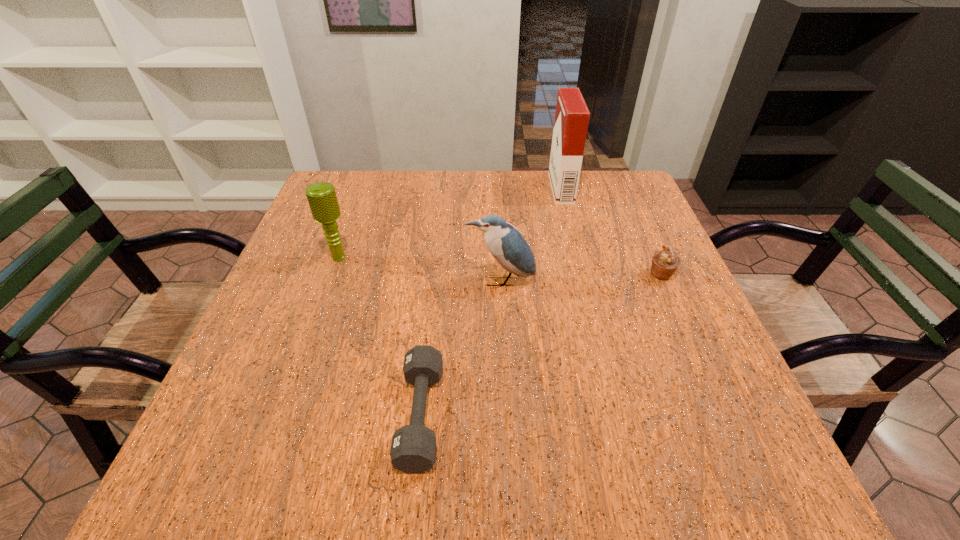
Identify the location of the farthest object. Image resolution: width=960 pixels, height=540 pixels. (572, 116).

This screenshot has width=960, height=540. Find the location of `the second object from right to left`. the second object from right to left is located at coordinates (572, 116).

Image resolution: width=960 pixels, height=540 pixels. Identify the location of microphone. click(x=322, y=199).

Find the location of a particular element. This screenshot has height=540, width=960. the leftmost object is located at coordinates click(x=322, y=199).

Find the location of `bird`. bird is located at coordinates (509, 248).

The image size is (960, 540). Find the location of `the fourth tallest object`. the fourth tallest object is located at coordinates (665, 262).

This screenshot has width=960, height=540. Identify the location of the rightmost object. (665, 262).

The image size is (960, 540). I want to click on the fourth object from right to left, so click(413, 448).

The width and height of the screenshot is (960, 540). I want to click on dumbbell, so click(413, 448).

Identify the location of free space located 0.170m on the front-facing side of the farthest object. (492, 188).